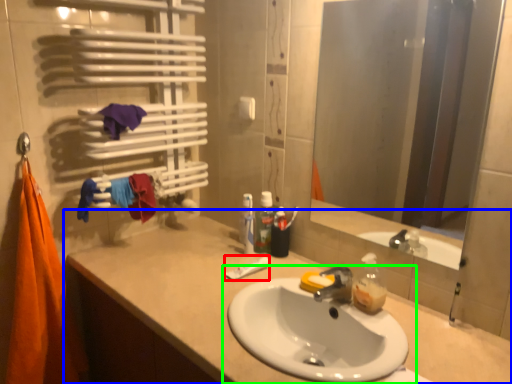
Question: Estimate the real-world distances between objects in this image. Which object is farther from toothpaste (highlighted by a red box), bathroom cabinet (highlighted by a blue box) or sink (highlighted by a green box)?

Choices:
 (A) bathroom cabinet
 (B) sink

Answer: (B)